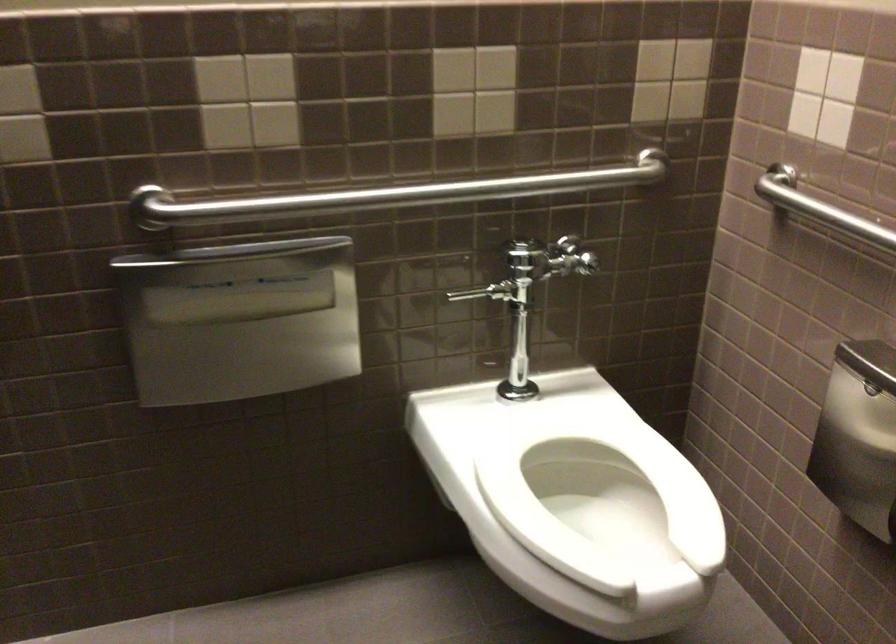
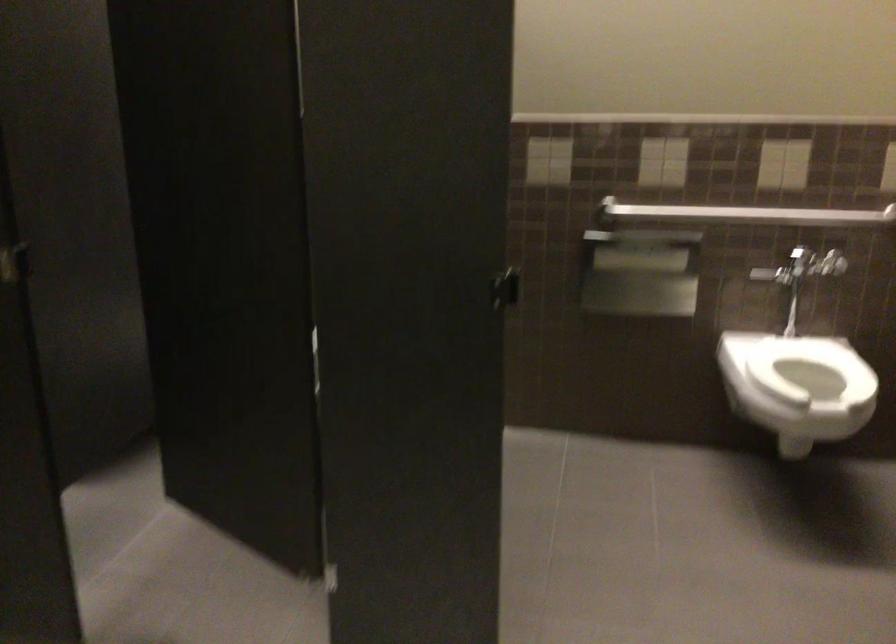
Question: The images are taken continuously from a first-person perspective. In which direction are you moving?

Choices:
 (A) Left
 (B) Right
 (C) Forward
 (D) Backward

Answer: (D)